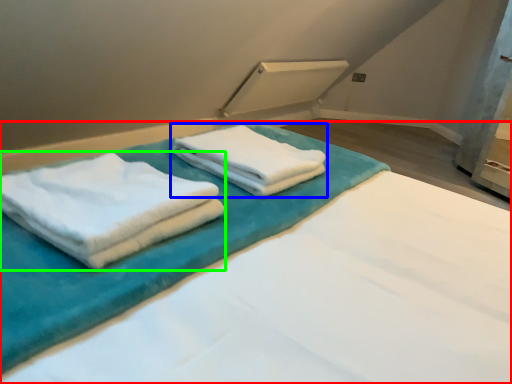
Question: Based on their relative distances, which object is nearer to bed (highlighted by a red box)? Choose from towel (highlighted by a blue box) and towel (highlighted by a green box).

Choices:
 (A) towel
 (B) towel

Answer: (A)